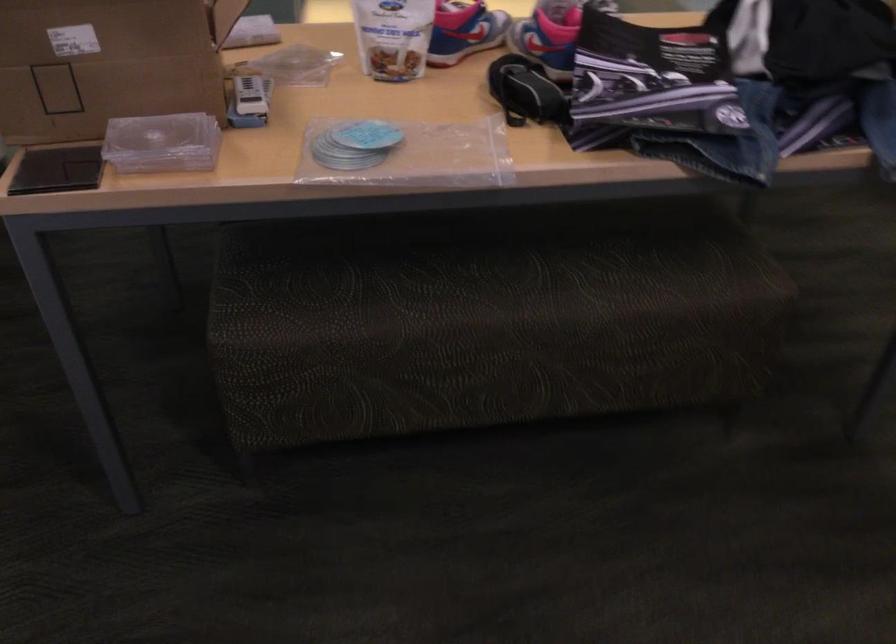
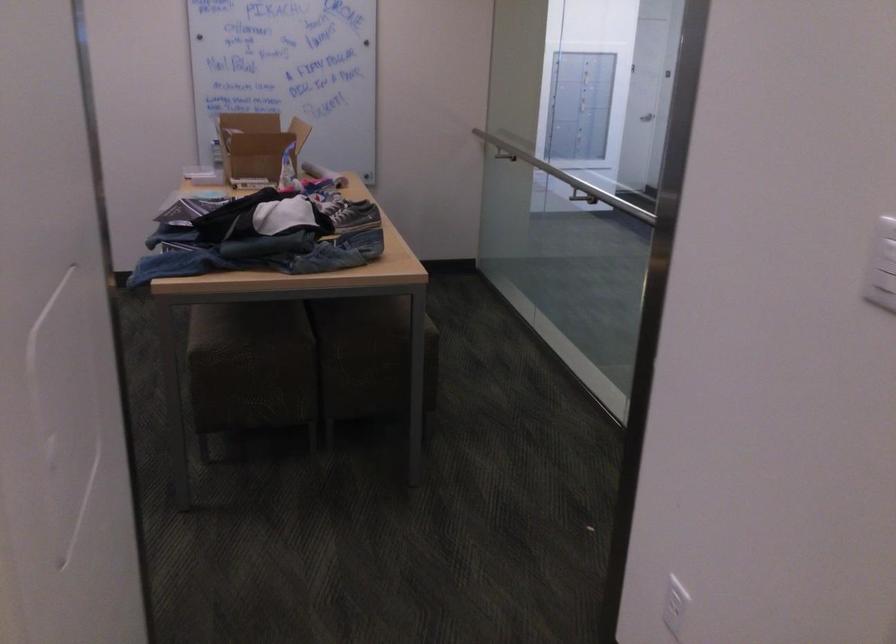
Question: I am providing you with two images of the same scene from different viewpoints. Which of the following objects are not visible in image2?

Choices:
 (A) cardboard box
 (B) metal handrail
 (C) model airplane
 (D) sofa sitting surface

Answer: (D)